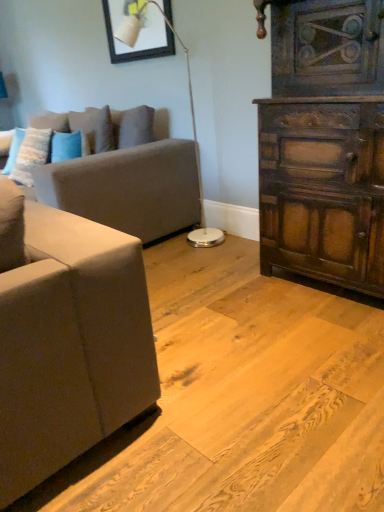
Question: From a real-world perspective, is matte gray couch at left beneath white glossy floor lamp at center?

Choices:
 (A) yes
 (B) no

Answer: (A)

Question: Does matte gray couch at left appear on the right side of white glossy floor lamp at center?

Choices:
 (A) yes
 (B) no

Answer: (B)

Question: From the image's perspective, would you say matte gray couch at left is shown under white glossy floor lamp at center?

Choices:
 (A) no
 (B) yes

Answer: (B)

Question: Considering the relative sizes of matte gray couch at left and white glossy floor lamp at center in the image provided, is matte gray couch at left smaller than white glossy floor lamp at center?

Choices:
 (A) yes
 (B) no

Answer: (B)

Question: Is matte gray couch at left beside white glossy floor lamp at center?

Choices:
 (A) yes
 (B) no

Answer: (B)

Question: Considering the relative sizes of matte gray couch at left and white glossy floor lamp at center in the image provided, is matte gray couch at left shorter than white glossy floor lamp at center?

Choices:
 (A) no
 (B) yes

Answer: (B)

Question: Could you tell me if white glossy floor lamp at center is turned towards matte gray couch at left?

Choices:
 (A) no
 (B) yes

Answer: (A)

Question: Is matte gray couch at left completely or partially inside white glossy floor lamp at center?

Choices:
 (A) yes
 (B) no

Answer: (B)

Question: From a real-world perspective, is white glossy floor lamp at center positioned under matte gray couch at left based on gravity?

Choices:
 (A) yes
 (B) no

Answer: (B)

Question: From the image's perspective, is white glossy floor lamp at center on top of matte gray couch at left?

Choices:
 (A) no
 (B) yes

Answer: (B)

Question: Does white glossy floor lamp at center have a lesser width compared to matte gray couch at left?

Choices:
 (A) yes
 (B) no

Answer: (A)

Question: Is white glossy floor lamp at center not close to matte gray couch at left?

Choices:
 (A) yes
 (B) no

Answer: (B)

Question: Are matte black picture frame at upper center and matte gray couch at left beside each other?

Choices:
 (A) yes
 (B) no

Answer: (B)